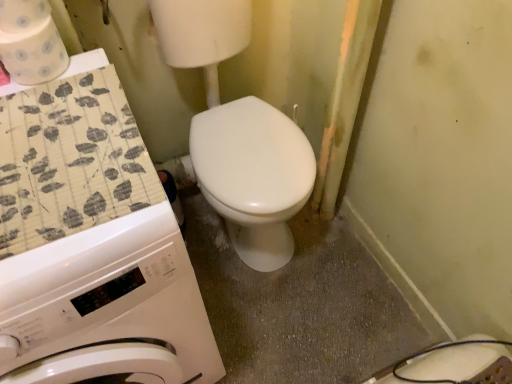
You are a GUI agent. You are given a task and a screenshot of the screen. Output one action in this format:
    pyautogui.click(x=<x>, y=<y>)
    Task: Click on the patterned paper towel at upper left, acting as the first toilet paper starting from the bottom
    The image size is (512, 384).
    Given the screenshot: What is the action you would take?
    pyautogui.click(x=30, y=42)

The height and width of the screenshot is (384, 512). I want to click on white paper towel at upper left, placed as the 1th toilet paper when sorted from top to bottom, so click(x=23, y=15).

From the image's perspective, is white paper towel at upper left, the 2th toilet paper in the bottom-to-top sequence, located beneath patterned paper towel at upper left, acting as the first toilet paper starting from the bottom?

No.

Does point (13, 14) come behind point (47, 27)?

That is False.

From a real-world perspective, is white paper towel at upper left, the 2th toilet paper in the bottom-to-top sequence, on top of patterned paper towel at upper left, acting as the first toilet paper starting from the bottom?

Indeed, from a real-world perspective, white paper towel at upper left, the 2th toilet paper in the bottom-to-top sequence, stands above patterned paper towel at upper left, acting as the first toilet paper starting from the bottom.

Which of these two, white glossy washing machine at left or patterned paper towel at upper left, acting as the first toilet paper starting from the bottom, stands shorter?

With less height is patterned paper towel at upper left, acting as the first toilet paper starting from the bottom.

From the picture: Between white glossy washing machine at left and patterned paper towel at upper left, acting as the first toilet paper starting from the bottom, which one is positioned behind?

patterned paper towel at upper left, acting as the first toilet paper starting from the bottom, is further from the camera.

Does white glossy washing machine at left appear on the left side of patterned paper towel at upper left, acting as the first toilet paper starting from the bottom?

Yes, white glossy washing machine at left is to the left of patterned paper towel at upper left, acting as the first toilet paper starting from the bottom.

Is patterned paper towel at upper left, which is the second toilet paper in top-to-bottom order, in front of white paper towel at upper left, the 2th toilet paper in the bottom-to-top sequence?

No, patterned paper towel at upper left, which is the second toilet paper in top-to-bottom order, is further to the viewer.

Are patterned paper towel at upper left, acting as the first toilet paper starting from the bottom, and white paper towel at upper left, the 2th toilet paper in the bottom-to-top sequence, located far from each other?

Actually, patterned paper towel at upper left, acting as the first toilet paper starting from the bottom, and white paper towel at upper left, the 2th toilet paper in the bottom-to-top sequence, are a little close together.

Based on the photo, looking at the image, does patterned paper towel at upper left, which is the second toilet paper in top-to-bottom order, seem bigger or smaller compared to white paper towel at upper left, placed as the 1th toilet paper when sorted from top to bottom?

patterned paper towel at upper left, which is the second toilet paper in top-to-bottom order, is bigger than white paper towel at upper left, placed as the 1th toilet paper when sorted from top to bottom.

From the image's perspective, is patterned paper towel at upper left, acting as the first toilet paper starting from the bottom, on top of white paper towel at upper left, placed as the 1th toilet paper when sorted from top to bottom?

No, from the image's perspective, patterned paper towel at upper left, acting as the first toilet paper starting from the bottom, is not above white paper towel at upper left, placed as the 1th toilet paper when sorted from top to bottom.

Considering the sizes of objects white glossy washing machine at left and white paper towel at upper left, the 2th toilet paper in the bottom-to-top sequence, in the image provided, who is taller, white glossy washing machine at left or white paper towel at upper left, the 2th toilet paper in the bottom-to-top sequence,?

Standing taller between the two is white glossy washing machine at left.

Could you measure the distance between white glossy washing machine at left and white paper towel at upper left, placed as the 1th toilet paper when sorted from top to bottom?

white glossy washing machine at left and white paper towel at upper left, placed as the 1th toilet paper when sorted from top to bottom, are 58.78 centimeters apart.

Is white glossy washing machine at left turned away from white paper towel at upper left, placed as the 1th toilet paper when sorted from top to bottom?

No.

From a real-world perspective, is white glossy washing machine at left physically below white paper towel at upper left, placed as the 1th toilet paper when sorted from top to bottom?

Correct, in the physical world, white glossy washing machine at left is lower than white paper towel at upper left, placed as the 1th toilet paper when sorted from top to bottom.

In terms of width, does white paper towel at upper left, placed as the 1th toilet paper when sorted from top to bottom, look wider or thinner when compared to white glossy washing machine at left?

Considering their sizes, white paper towel at upper left, placed as the 1th toilet paper when sorted from top to bottom, looks slimmer than white glossy washing machine at left.

Is white paper towel at upper left, the 2th toilet paper in the bottom-to-top sequence, to the right of white glossy washing machine at left from the viewer's perspective?

Indeed, white paper towel at upper left, the 2th toilet paper in the bottom-to-top sequence, is positioned on the right side of white glossy washing machine at left.

Is white paper towel at upper left, the 2th toilet paper in the bottom-to-top sequence, touching white glossy washing machine at left?

No, white paper towel at upper left, the 2th toilet paper in the bottom-to-top sequence, is not next to white glossy washing machine at left.

From the image's perspective, is patterned paper towel at upper left, which is the second toilet paper in top-to-bottom order, positioned above or below white glossy washing machine at left?

Based on their image positions, patterned paper towel at upper left, which is the second toilet paper in top-to-bottom order, is located above white glossy washing machine at left.

Looking at this image, from a real-world perspective, who is located lower, patterned paper towel at upper left, which is the second toilet paper in top-to-bottom order, or white glossy washing machine at left?

white glossy washing machine at left, from a real-world perspective.

Measure the distance from patterned paper towel at upper left, which is the second toilet paper in top-to-bottom order, to white glossy washing machine at left.

→ patterned paper towel at upper left, which is the second toilet paper in top-to-bottom order, is 20.16 inches from white glossy washing machine at left.

The width and height of the screenshot is (512, 384). Find the location of `washing machine to the left of patterned paper towel at upper left, which is the second toilet paper in top-to-bottom order`. washing machine to the left of patterned paper towel at upper left, which is the second toilet paper in top-to-bottom order is located at coordinates (106, 307).

Locate an element on the screen. The image size is (512, 384). toilet paper located in front of the patterned paper towel at upper left, acting as the first toilet paper starting from the bottom is located at coordinates (23, 15).

Where is `the 2nd toilet paper to the right of the white glossy washing machine at left, counting from the anchor's position`? The width and height of the screenshot is (512, 384). the 2nd toilet paper to the right of the white glossy washing machine at left, counting from the anchor's position is located at coordinates 30,42.

Which object lies nearer to the anchor point white paper towel at upper left, the 2th toilet paper in the bottom-to-top sequence, white glossy washing machine at left or patterned paper towel at upper left, which is the second toilet paper in top-to-bottom order?

patterned paper towel at upper left, which is the second toilet paper in top-to-bottom order.

From the image, which object appears to be farther from patterned paper towel at upper left, acting as the first toilet paper starting from the bottom, white glossy washing machine at left or white paper towel at upper left, the 2th toilet paper in the bottom-to-top sequence?

The object further to patterned paper towel at upper left, acting as the first toilet paper starting from the bottom, is white glossy washing machine at left.

Based on their spatial positions, is patterned paper towel at upper left, acting as the first toilet paper starting from the bottom, or white glossy washing machine at left closer to white paper towel at upper left, placed as the 1th toilet paper when sorted from top to bottom?

Based on the image, patterned paper towel at upper left, acting as the first toilet paper starting from the bottom, appears to be nearer to white paper towel at upper left, placed as the 1th toilet paper when sorted from top to bottom.

Which object lies further to the anchor point white glossy washing machine at left, patterned paper towel at upper left, acting as the first toilet paper starting from the bottom, or white paper towel at upper left, the 2th toilet paper in the bottom-to-top sequence?

white paper towel at upper left, the 2th toilet paper in the bottom-to-top sequence.

Considering their positions, is white paper towel at upper left, the 2th toilet paper in the bottom-to-top sequence, positioned further to patterned paper towel at upper left, acting as the first toilet paper starting from the bottom, than white glossy washing machine at left?

white glossy washing machine at left.

Looking at the image, which one is located further to white glossy washing machine at left, white paper towel at upper left, the 2th toilet paper in the bottom-to-top sequence, or patterned paper towel at upper left, acting as the first toilet paper starting from the bottom?

Among the two, white paper towel at upper left, the 2th toilet paper in the bottom-to-top sequence, is located further to white glossy washing machine at left.

Locate an element on the screen. toilet paper that lies between white paper towel at upper left, placed as the 1th toilet paper when sorted from top to bottom, and white glossy washing machine at left from top to bottom is located at coordinates pyautogui.click(x=30, y=42).